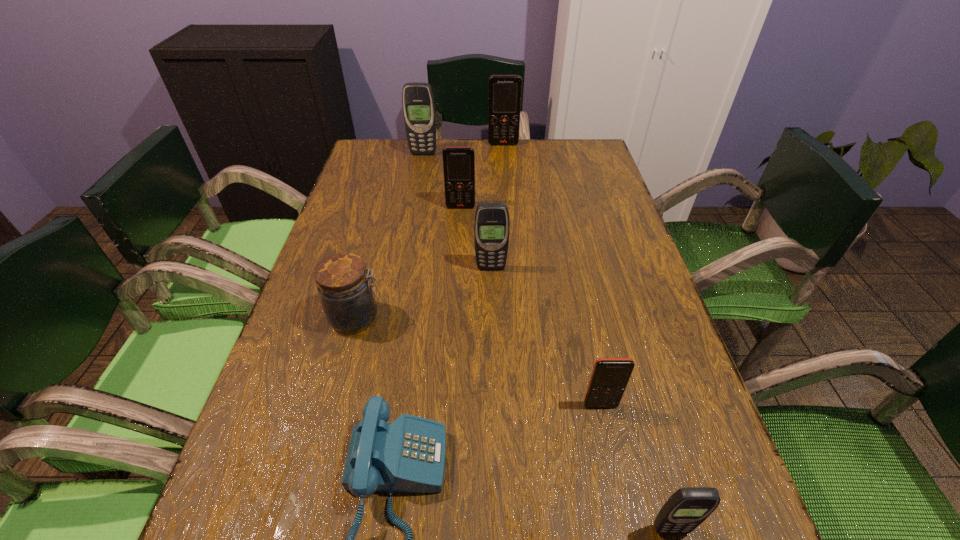
I want to click on free spot between the second smallest gray cellular telephone and the sixth farthest object, so click(545, 336).

What are the coordinates of `free space between the rightmost object and the second biggest orange cellular telephone` in the screenshot? It's located at (565, 368).

You are a GUI agent. You are given a task and a screenshot of the screen. Output one action in this format:
    pyautogui.click(x=<x>, y=<y>)
    Task: Click on the free space that is in between the farthest object and the fourth nearest object
    This screenshot has width=960, height=540.
    Given the screenshot: What is the action you would take?
    pyautogui.click(x=430, y=231)

You are a GUI agent. You are given a task and a screenshot of the screen. Output one action in this format:
    pyautogui.click(x=<x>, y=<y>)
    Task: Click on the sixth closest object to the fifth cellular telephone from left to right
    The width and height of the screenshot is (960, 540).
    Given the screenshot: What is the action you would take?
    pyautogui.click(x=418, y=103)

Identify which object is the fourth closest to the farthest orange cellular telephone. Please provide its 2D coordinates. Your answer should be formatted as a tuple, i.e. [(x, y)], where the tuple contains the x and y coordinates of a point satisfying the conditions above.

[(348, 300)]

Locate which cellular telephone ranks third in proximity to the jar. Please provide its 2D coordinates. Your answer should be formatted as a tuple, i.e. [(x, y)], where the tuple contains the x and y coordinates of a point satisfying the conditions above.

[(610, 376)]

Choose which cellular telephone is the sixth nearest neighbor to the blue telephone. Please provide its 2D coordinates. Your answer should be formatted as a tuple, i.e. [(x, y)], where the tuple contains the x and y coordinates of a point satisfying the conditions above.

[(505, 91)]

Identify which orange cellular telephone is the second nearest to the shortest object. Please provide its 2D coordinates. Your answer should be formatted as a tuple, i.e. [(x, y)], where the tuple contains the x and y coordinates of a point satisfying the conditions above.

[(458, 162)]

Identify which orange cellular telephone is the third nearest to the telephone. Please provide its 2D coordinates. Your answer should be formatted as a tuple, i.e. [(x, y)], where the tuple contains the x and y coordinates of a point satisfying the conditions above.

[(505, 91)]

Where is `the closest gray cellular telephone to the second nearest gray cellular telephone`? The image size is (960, 540). the closest gray cellular telephone to the second nearest gray cellular telephone is located at coordinates (418, 103).